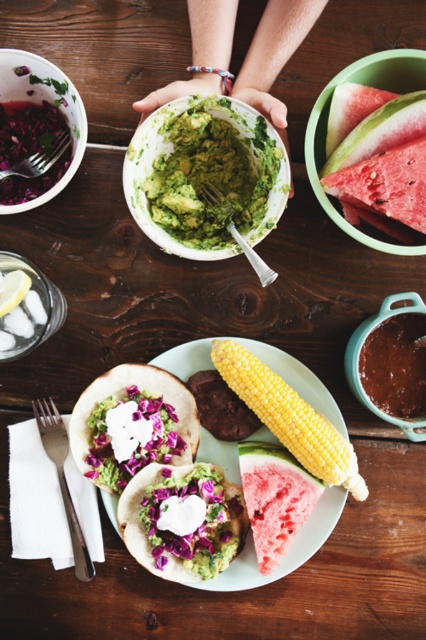
From the picture: You are a food critic evaluating the arrangement of this meal. The green matte guacamole taco at center is placed at coordinates 0.812 on the x and 0.430 on the y. Considering the table layout described, can you confirm if this taco is positioned exactly at the center of the table?

The green matte guacamole taco at center is located at point (183, 518), which means it is positioned at the center of the table as described.

You are planning to arrange these items on a smaller plate. Which item, the green matte guacamole taco at center or the pink juicy watermelon at center, would require more space due to its size?

The green matte guacamole taco at center requires more space because it has a larger size compared to the pink juicy watermelon at center.